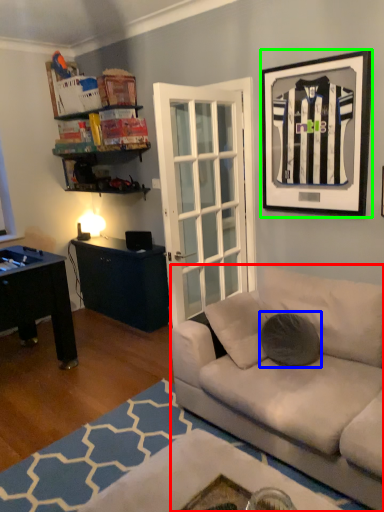
Question: Estimate the real-world distances between objects in this image. Which object is closer to studio couch (highlighted by a red box), pillow (highlighted by a blue box) or picture frame (highlighted by a green box)?

Choices:
 (A) pillow
 (B) picture frame

Answer: (A)